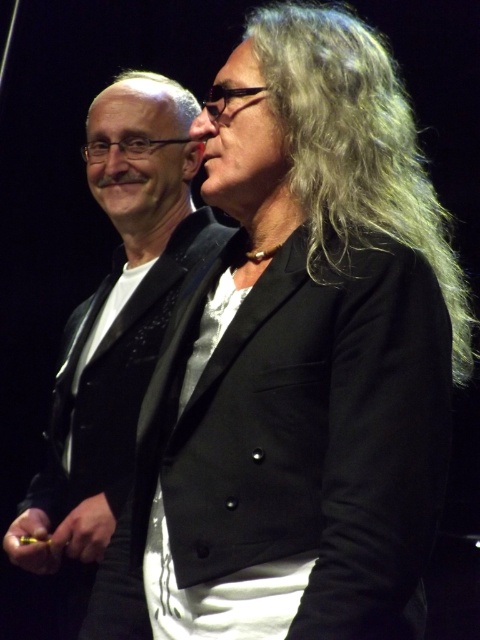
You are a photographer setting up for a stage event. You need to ensure that the black glossy suit at center and the gray matte hair at upper right are both visible in your shot. Based on their positions, which object is closer to the bottom of the frame?

The black glossy suit at center is positioned under the gray matte hair at upper right, meaning it is closer to the bottom of the frame.

You are a photographer adjusting your camera settings to focus on two subjects in the image. You notice the matte black hair at center and the smooth skin nose at center. Which object should you focus on first to ensure proper depth of field?

The matte black hair at center is closer to the viewer than the smooth skin nose at center, so focusing on the matte black hair at center first will help achieve proper depth of field.